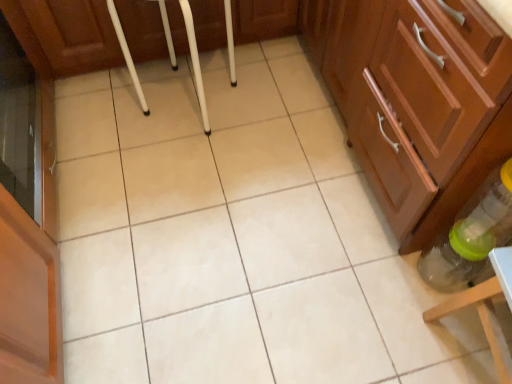
Identify the location of unoccupied area in front of white plastic bar stool at center. (184, 175).